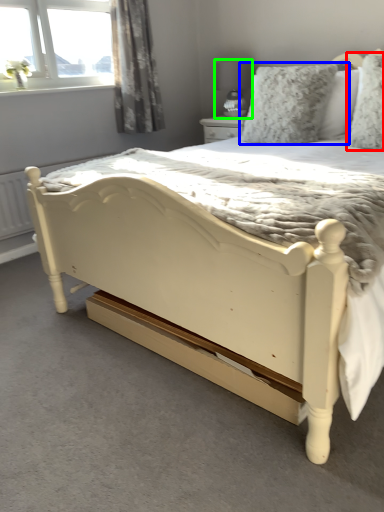
Question: Which object is the farthest from pillow (highlighted by a red box)? Choose among these: pillow (highlighted by a blue box) or lamp (highlighted by a green box).

Choices:
 (A) pillow
 (B) lamp

Answer: (B)